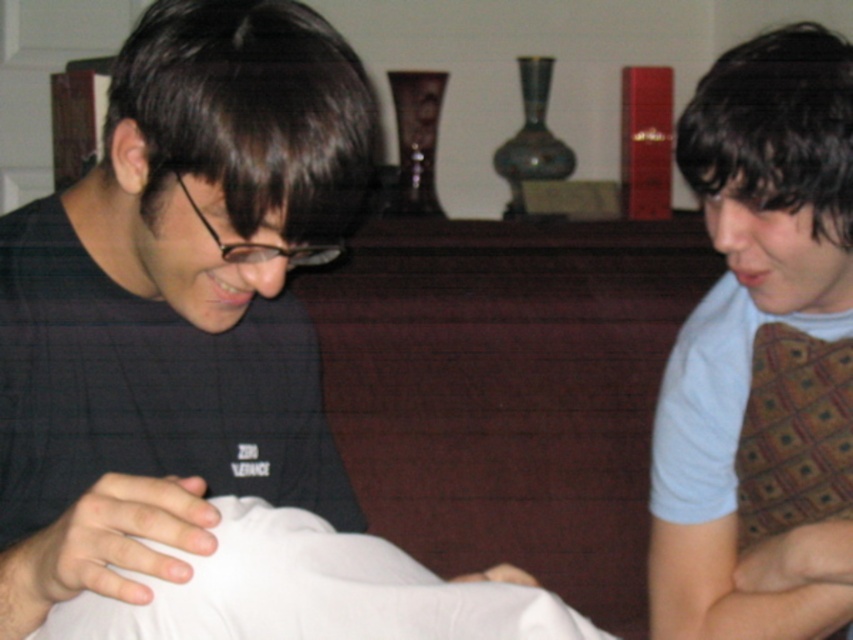
Does white fabric at center have a greater width compared to light blue shirt at right?

Indeed, white fabric at center has a greater width compared to light blue shirt at right.

Is point (474, 618) closer to camera compared to point (799, 604)?

Yes, point (474, 618) is closer to viewer.

Between point (300, 42) and point (730, 61), which one is positioned in front?

Point (300, 42)

I want to click on white fabric at center, so click(204, 358).